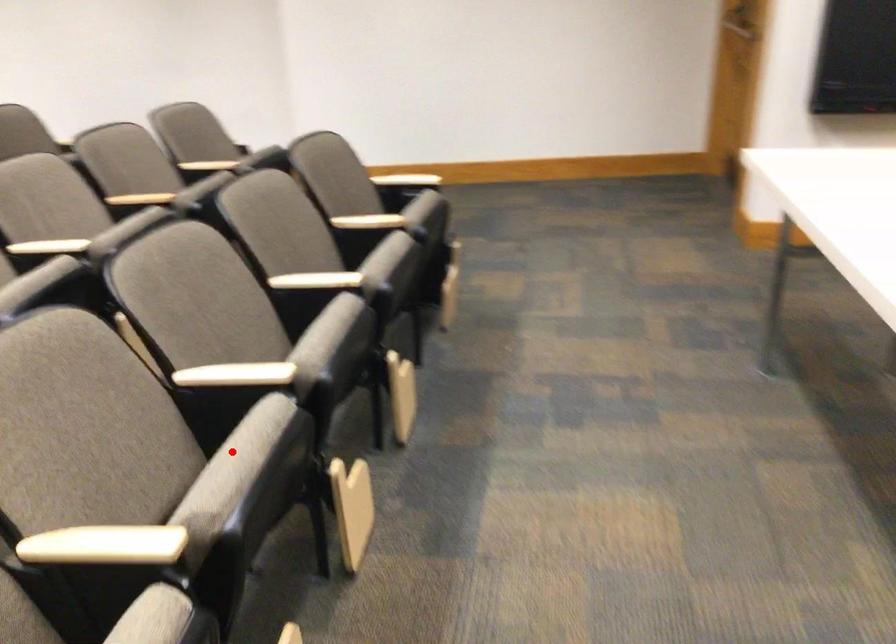
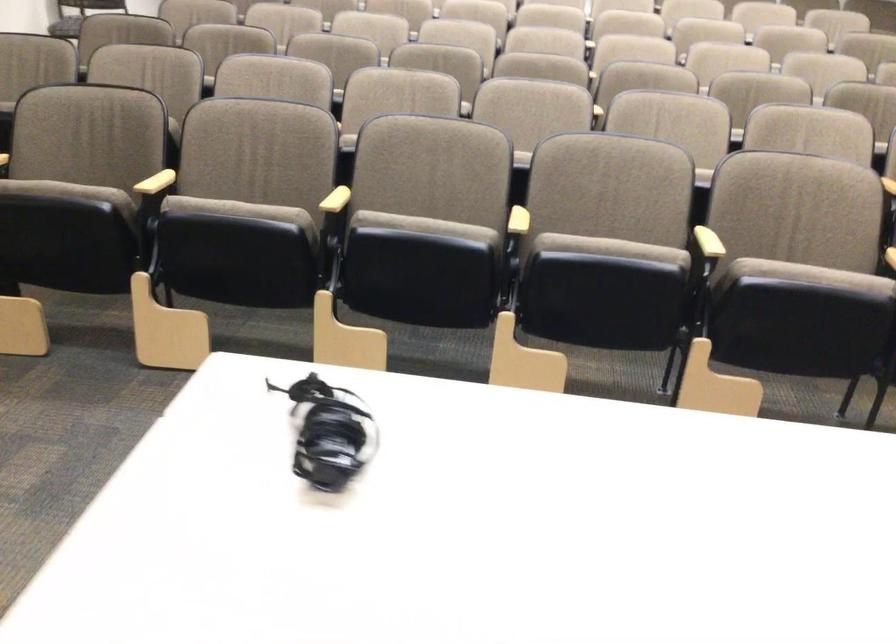
Question: I am providing you with two images of the same scene from different viewpoints. A red point is marked on the first image. At the location where the point appears in image 1, is it still visible in image 2?

Choices:
 (A) Yes
 (B) No

Answer: (A)